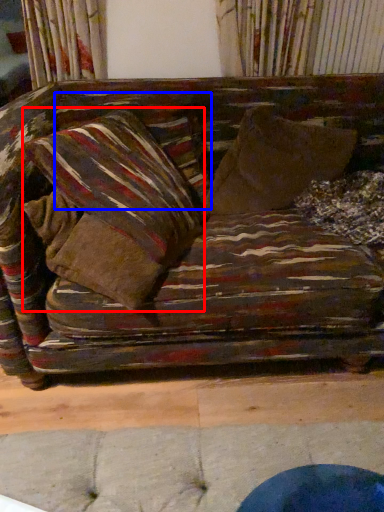
Question: Which of the following is the closest to the observer, pillow (highlighted by a red box) or pillow (highlighted by a blue box)?

Choices:
 (A) pillow
 (B) pillow

Answer: (A)